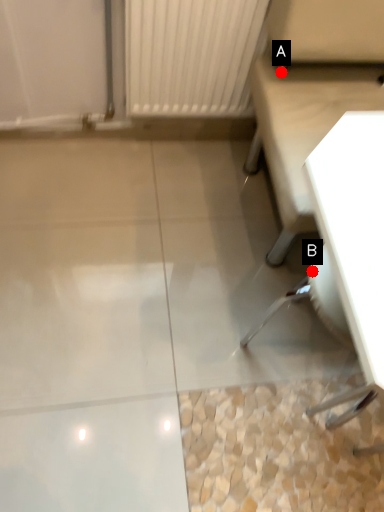
Question: Two points are circled on the image, labeled by A and B beside each circle. Which point is closer to the camera taking this photo?

Choices:
 (A) A is closer
 (B) B is closer

Answer: (B)